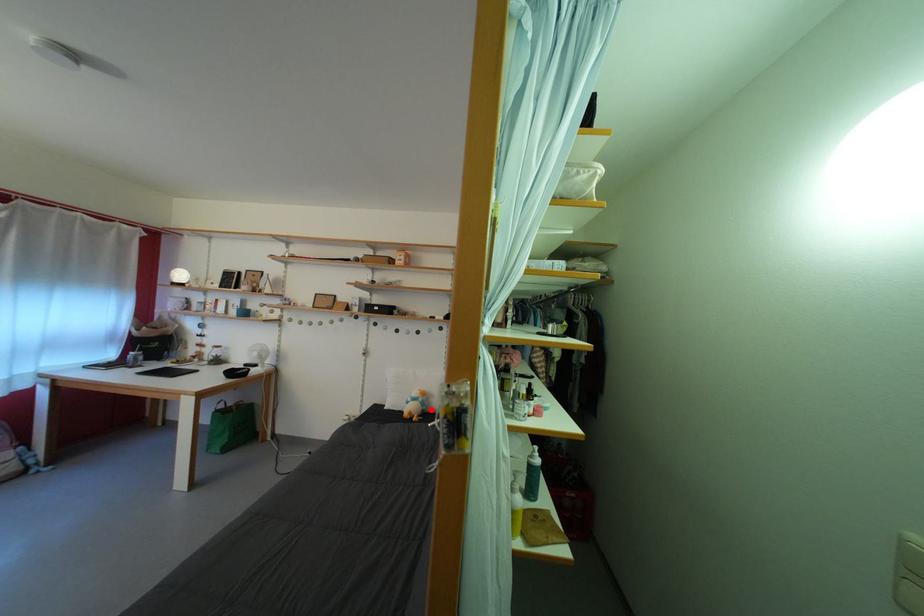
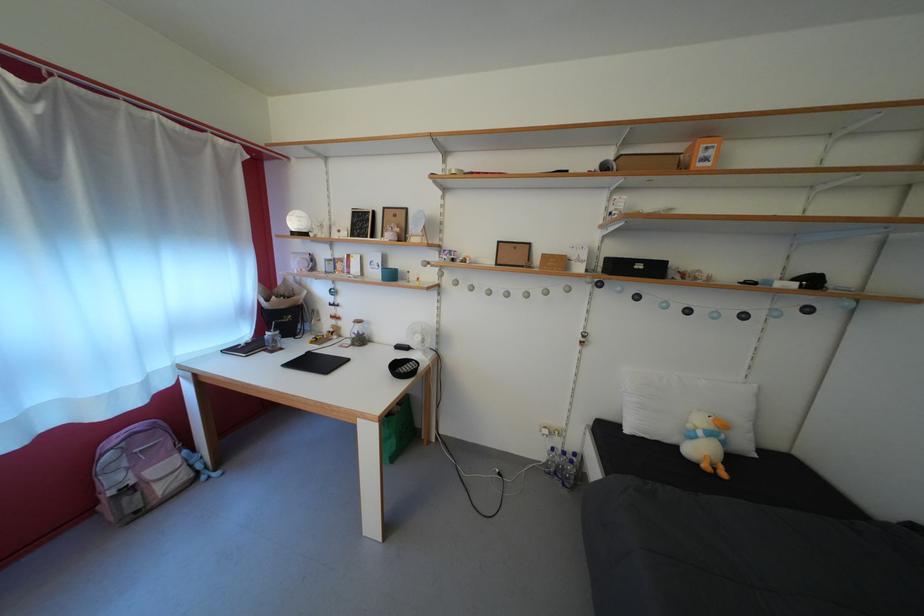
Question: I am providing you with two images of the same scene from different viewpoints. In image1, a red point is highlighted. Considering the same 3D point in image2, which of the following is correct?

Choices:
 (A) It is closer
 (B) It is farther

Answer: (A)